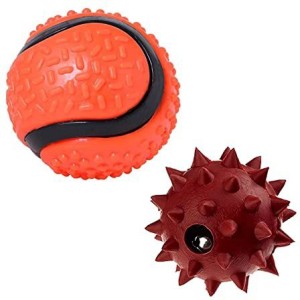
Find the location of a particular element. This screenshot has height=300, width=300. sponge is located at coordinates (248, 217).